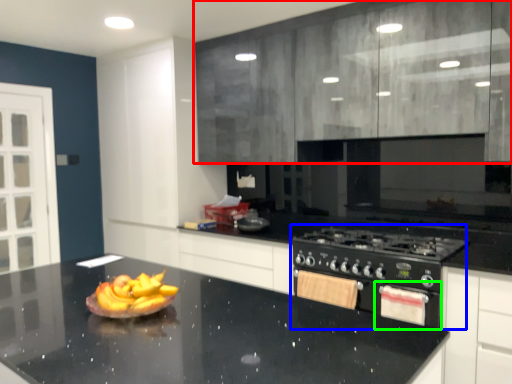
Question: Considering the real-world distances, which object is closest to cabinetry (highlighted by a red box)? appliance (highlighted by a blue box) or oven (highlighted by a green box).

Choices:
 (A) appliance
 (B) oven

Answer: (A)